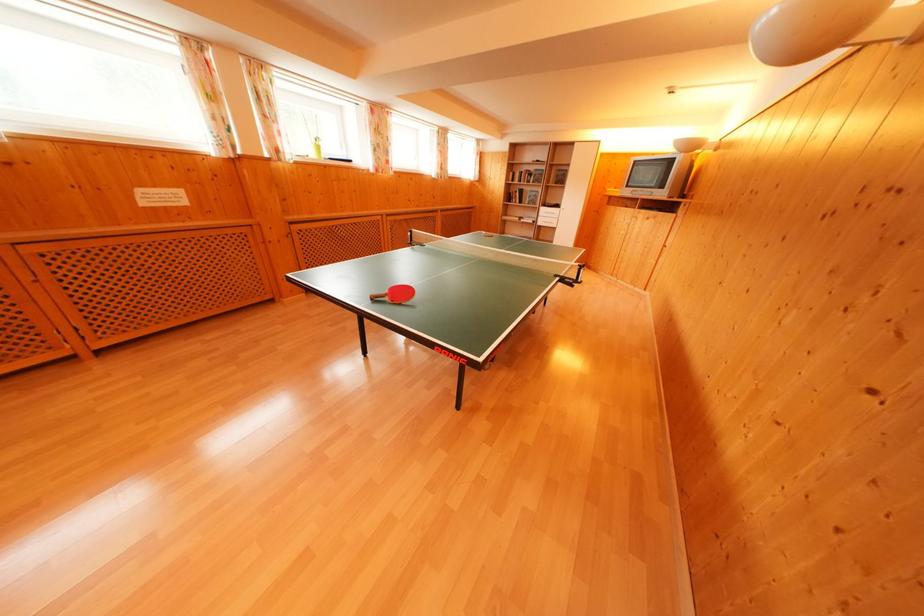
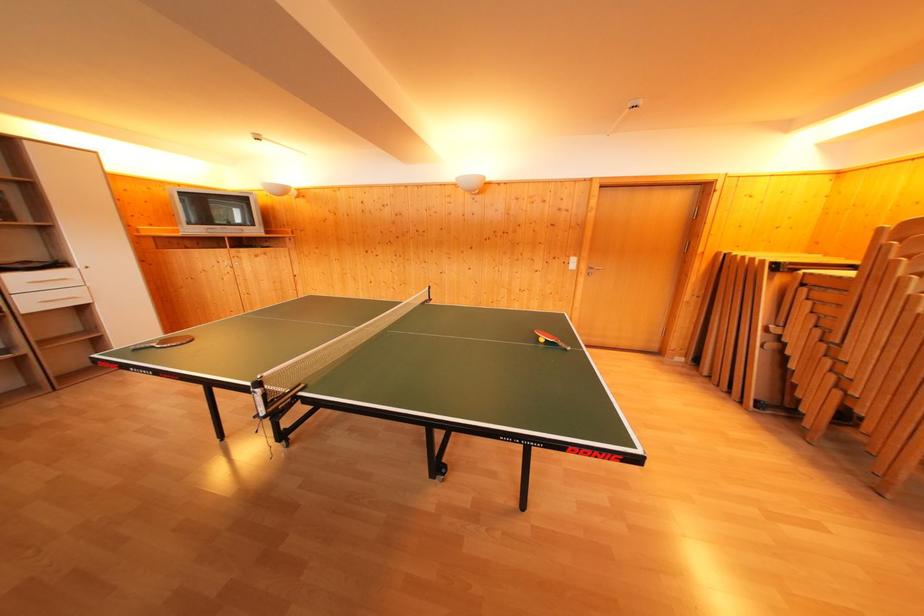
In the second image, find the point that corresponds to point (563, 211) in the first image.

(64, 270)